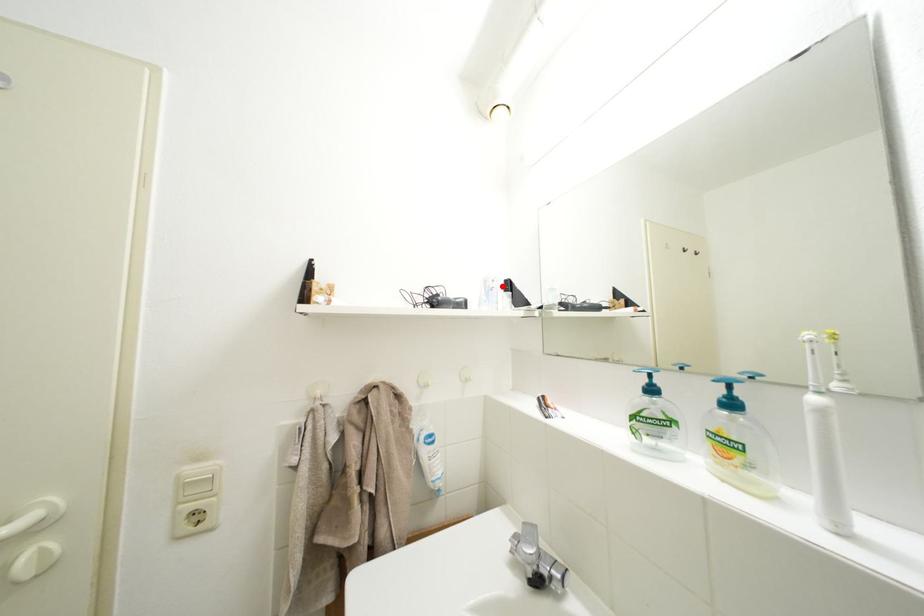
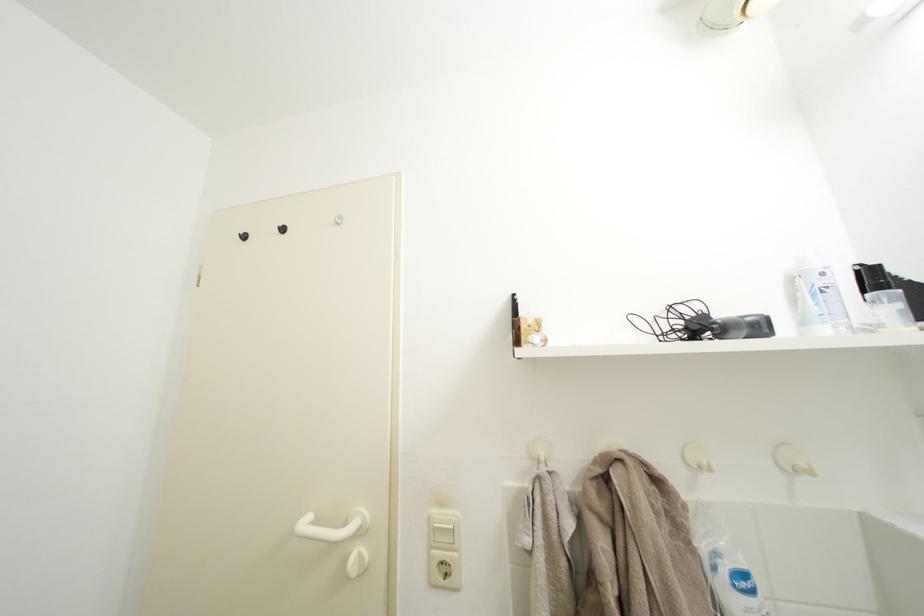
Where in the second image is the point corresponding to the highlighted location from the first image?

(833, 280)